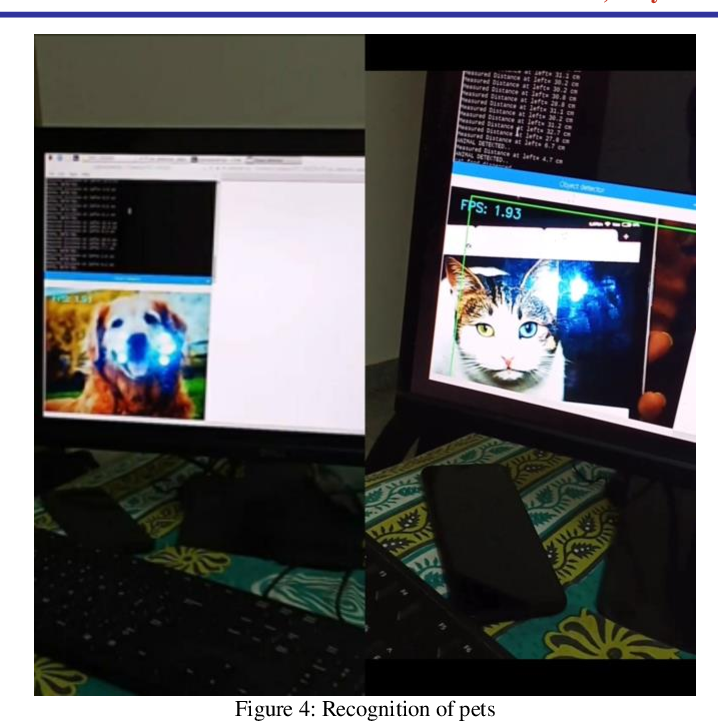
Find the location of a particular element. This screenshot has width=718, height=722. phone is located at coordinates (505, 583).